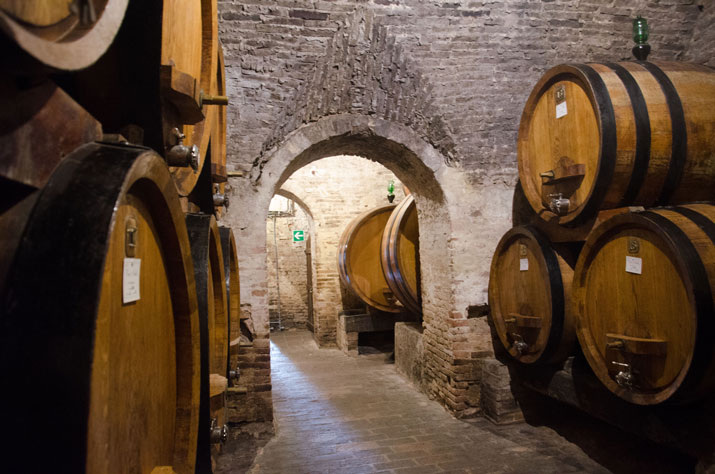
Find the location of a particular element. brick wall is located at coordinates (246, 14), (495, 45), (455, 376).